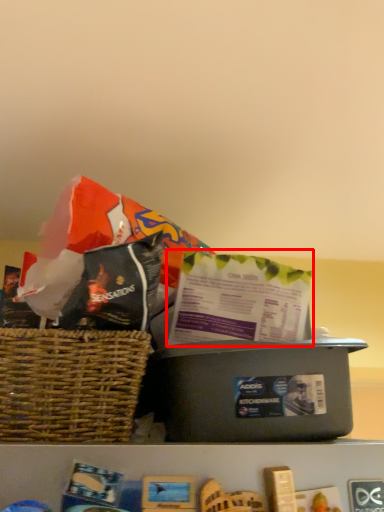
Question: Where is gift bag (annotated by the red box) located in relation to box in the image?

Choices:
 (A) left
 (B) right

Answer: (B)